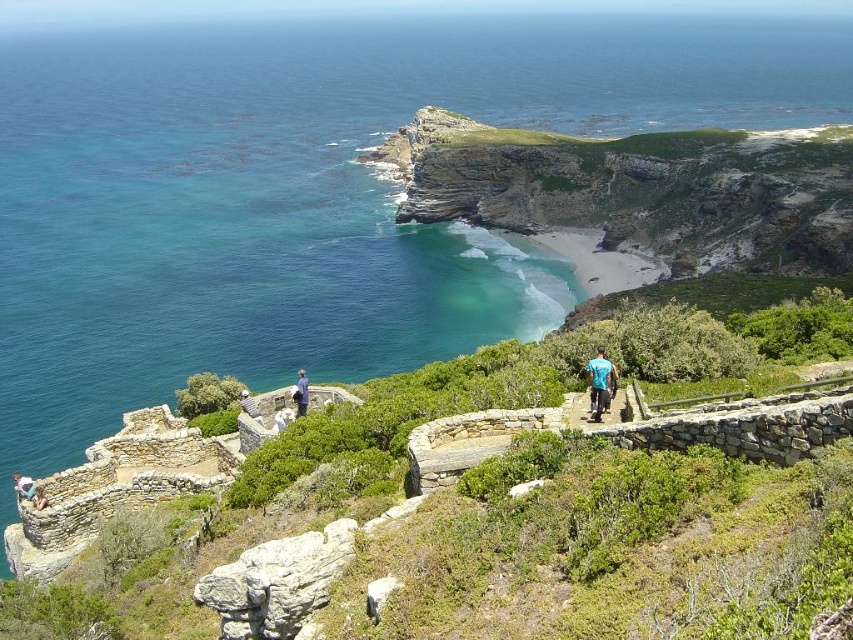
Question: Can you confirm if blue fabric shirt at center-right is thinner than blue denim jeans at lower left?

Choices:
 (A) no
 (B) yes

Answer: (B)

Question: Which of the following is the closest to the observer?

Choices:
 (A) (259, 416)
 (B) (593, 419)
 (C) (305, 408)
 (D) (16, 484)

Answer: (B)

Question: Can you confirm if blue fabric shirt at center is smaller than blue denim jeans at lower left?

Choices:
 (A) yes
 (B) no

Answer: (A)

Question: Which object appears closest to the camera in this image?

Choices:
 (A) blue fabric shirt at center
 (B) light blue fabric at center

Answer: (B)

Question: From the image, what is the correct spatial relationship of blue fabric shirt at center-right in relation to blue fabric shirt at center?

Choices:
 (A) above
 (B) below

Answer: (A)

Question: Considering the real-world distances, which object is closest to the blue denim jeans at lower left?

Choices:
 (A) blue fabric shirt at center
 (B) light blue fabric at center

Answer: (B)